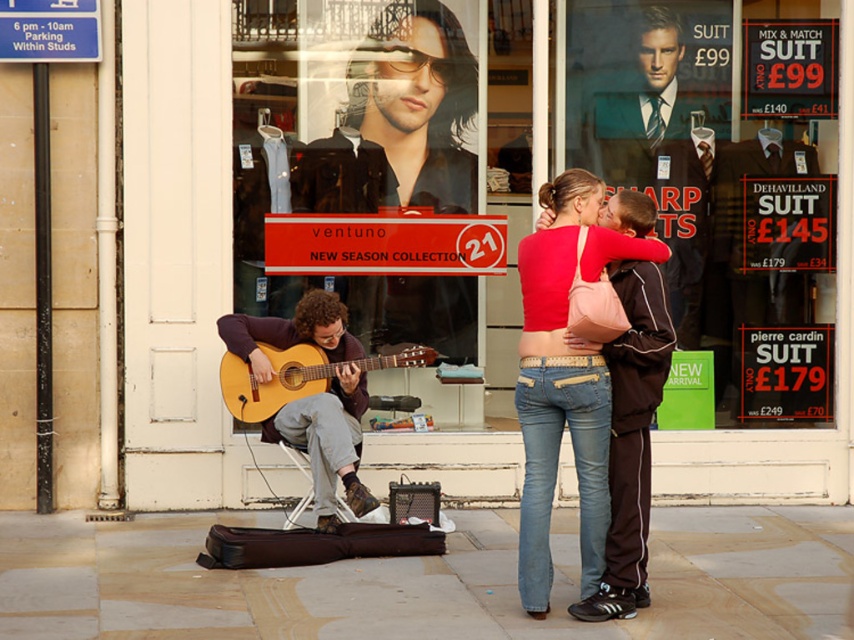
You are a customer standing in front of the store. You see the glass display at center and the acoustic guitar at center. Which object is closer to you?

The acoustic guitar at center is closer to you because the glass display at center is positioned over it, meaning the glass display is above the guitar.

You are a street performer who just finished a set. You need to pack your matte black guitar at center into your brown leather guitar case at lower center. Can you reach it without moving from your stool?

The brown leather guitar case at lower center and matte black guitar at center are 2.82 meters apart from each other. Since the distance is greater than an average person can reach, you cannot reach the matte black guitar at center from your current position.